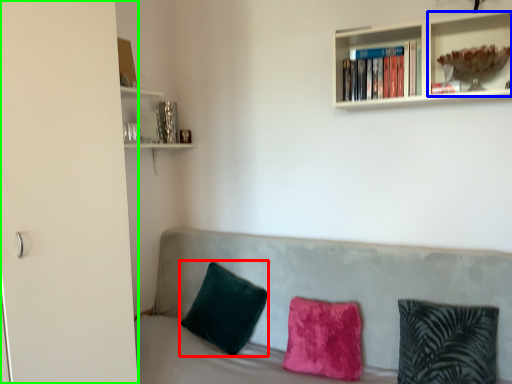
Question: Which object is the closest to the pillow (highlighted by a red box)? Choose among these: shelf (highlighted by a blue box) or glass door (highlighted by a green box).

Choices:
 (A) shelf
 (B) glass door

Answer: (B)